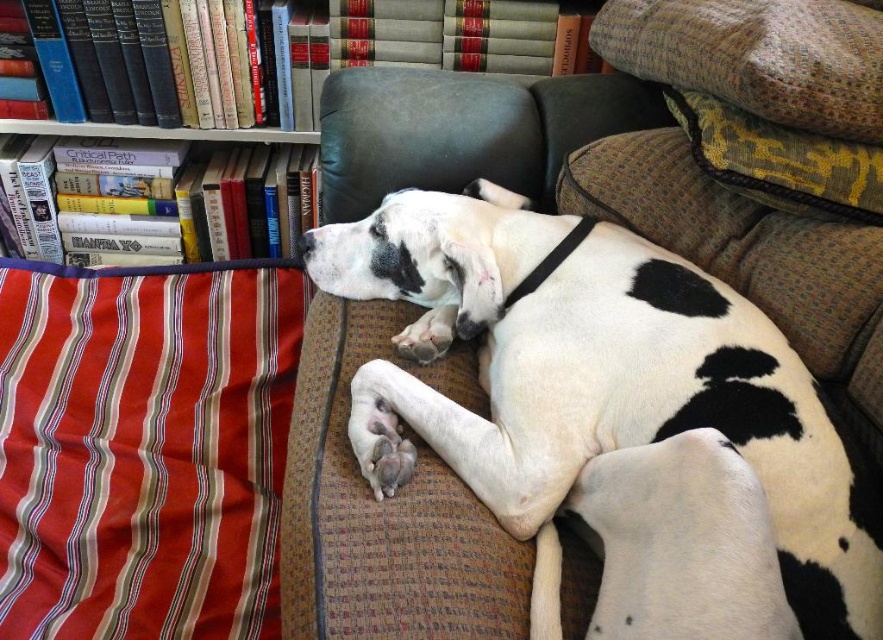
Is white fur at center to the right of striped fabric pillow at left from the viewer's perspective?

Correct, you'll find white fur at center to the right of striped fabric pillow at left.

Where is `white fur at center`? Image resolution: width=883 pixels, height=640 pixels. white fur at center is located at coordinates (593, 381).

Who is positioned more to the left, hardcover books at upper left or textured yellow-green pillow at upper right?

From the viewer's perspective, hardcover books at upper left appears more on the left side.

Image resolution: width=883 pixels, height=640 pixels. What do you see at coordinates (261, 198) in the screenshot? I see `hardcover books at upper left` at bounding box center [261, 198].

Where is `hardcover books at upper left`? The width and height of the screenshot is (883, 640). hardcover books at upper left is located at coordinates (261, 198).

Who is more forward, (x=136, y=3) or (x=828, y=64)?

Point (x=828, y=64) is more forward.

Between hardcover books at upper left and patterned fabric pillow at upper right, which one appears on the left side from the viewer's perspective?

hardcover books at upper left

Image resolution: width=883 pixels, height=640 pixels. Identify the location of hardcover books at upper left. (261, 198).

This screenshot has height=640, width=883. Identify the location of hardcover books at upper left. (261, 198).